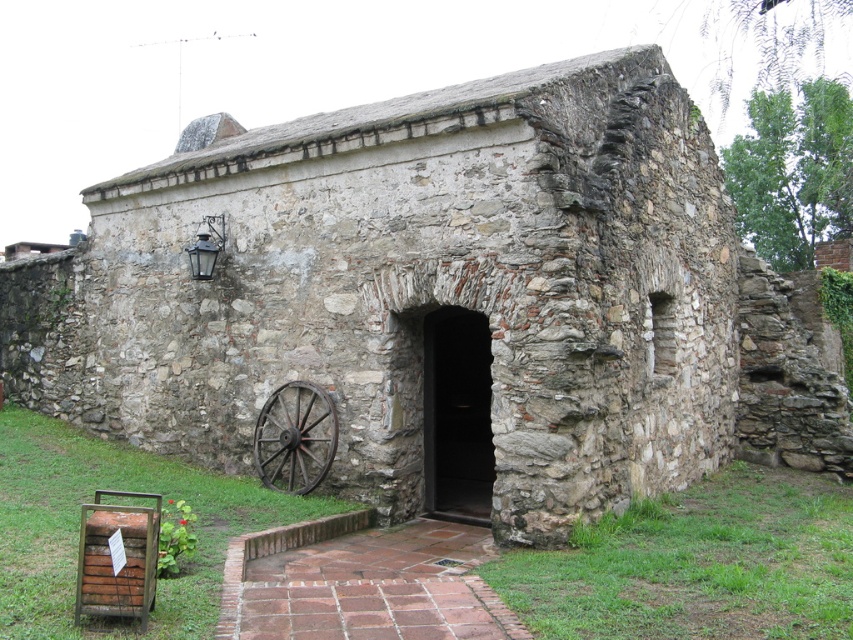
You are standing at point (283, 384) and want to walk to point (471, 506). Is the path between these two points clear of any obstacles?

Point (471, 506) is behind point (283, 384), so the path between them is blocked by the structure itself.

In the scene shown: You are standing in front of the rustic stone fort at center and looking towards the rusty metal wagon wheel at lower left. From your perspective, which object is positioned to the left?

The rustic stone fort at center is to the left of the rusty metal wagon wheel at lower left, so from your perspective, the rustic stone fort at center is positioned to the left.